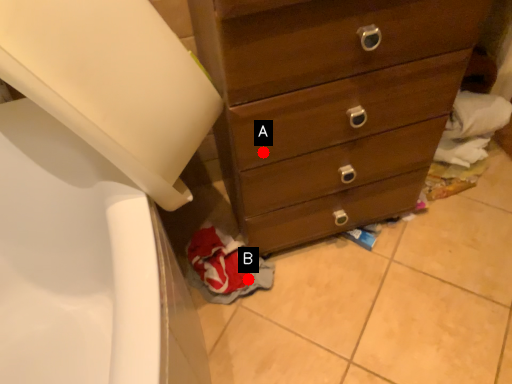
Question: Two points are circled on the image, labeled by A and B beside each circle. Which point is farther to the camera?

Choices:
 (A) A is further
 (B) B is further

Answer: (B)